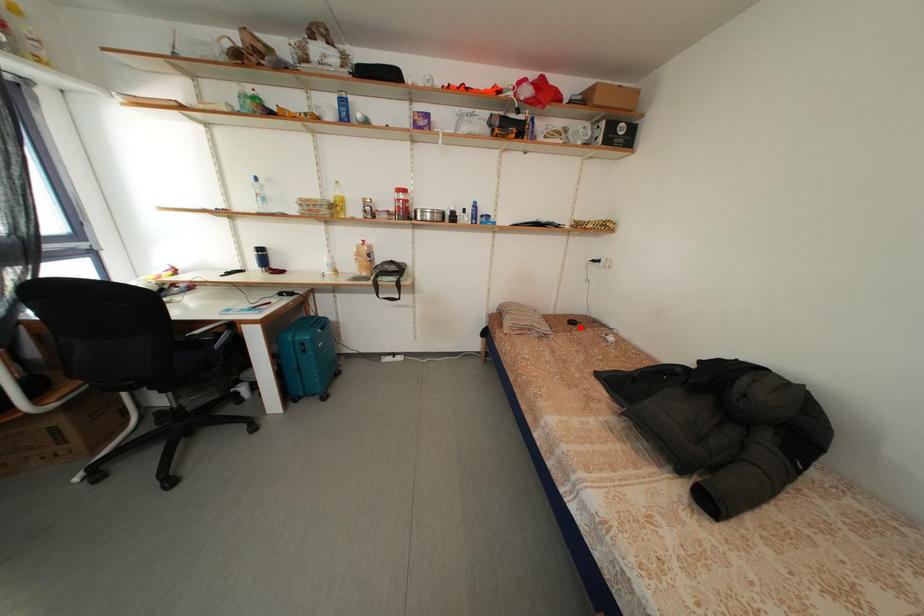
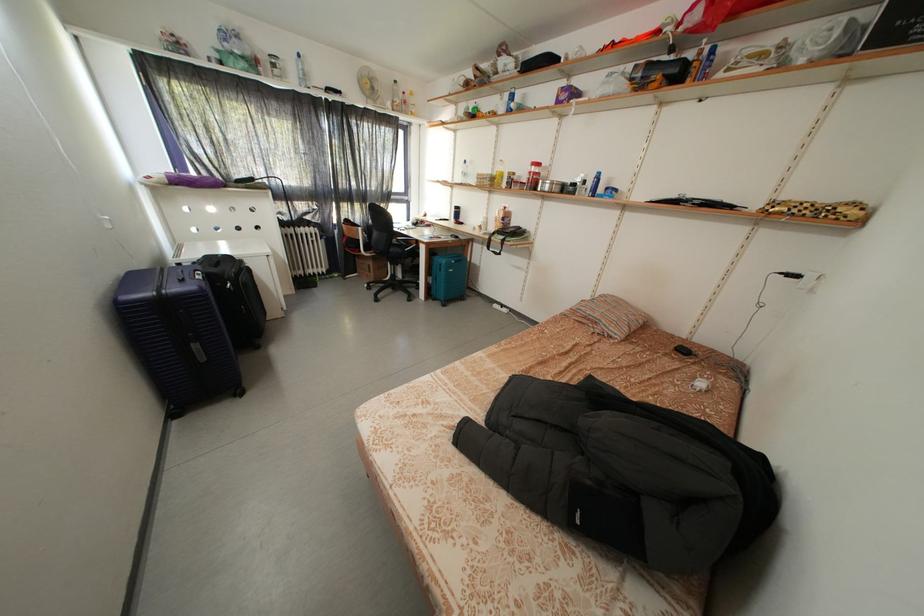
The point at the highlighted location is marked in the first image. Where is the corresponding point in the second image?

(691, 355)